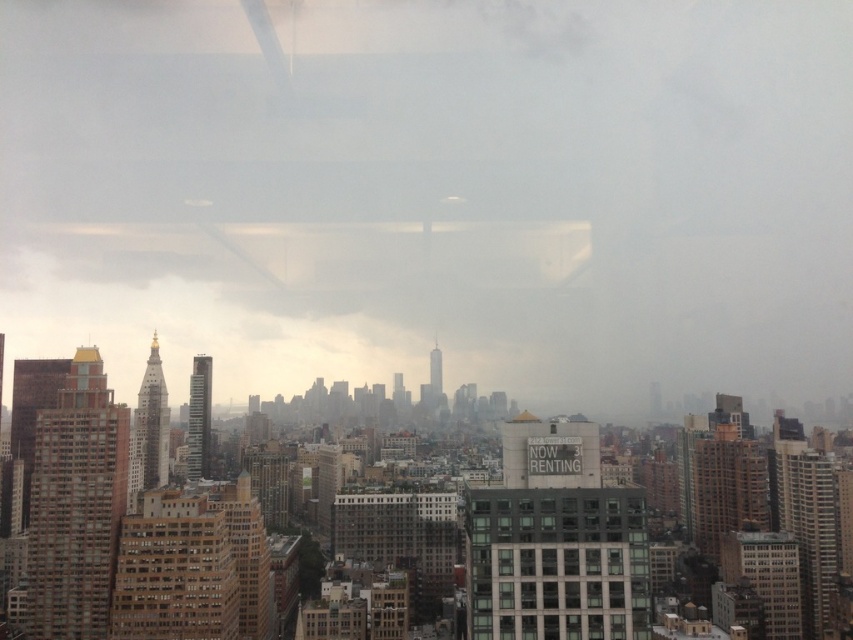
Is transparent glass cloud at center positioned behind dark gray glass windows at center?

Yes, transparent glass cloud at center is further from the viewer.

Who is lower down, transparent glass cloud at center or dark gray glass windows at center?

dark gray glass windows at center is lower down.

Is point (73, 22) positioned behind point (486, 492)?

Yes, it is.

This screenshot has height=640, width=853. Identify the location of transparent glass cloud at center. (434, 193).